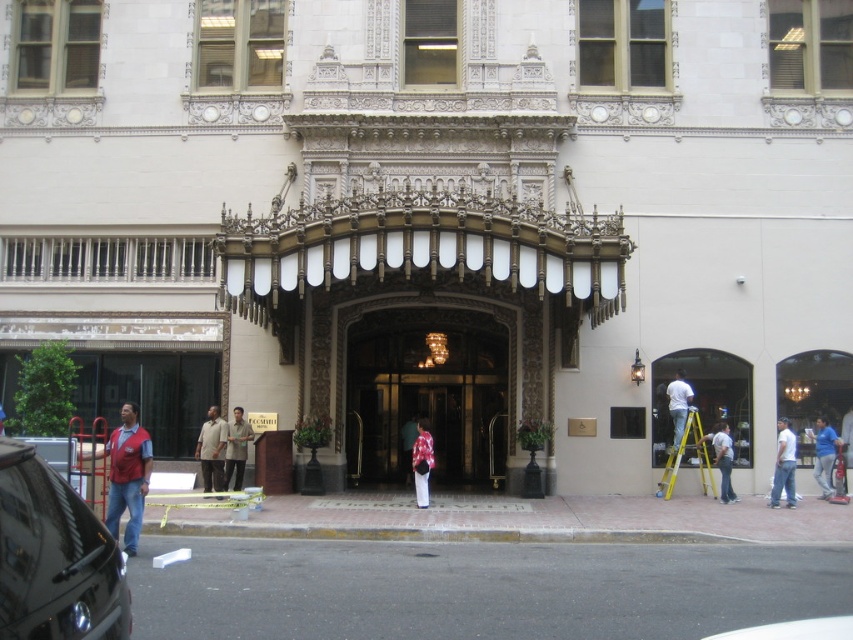
Question: Among these points, which one is farthest from the camera?

Choices:
 (A) (722, 460)
 (B) (465, 360)
 (C) (833, 445)

Answer: (B)

Question: Can you confirm if shiny black car at lower left is bigger than blue cotton shirt at center?

Choices:
 (A) no
 (B) yes

Answer: (B)

Question: Considering the real-world distances, which object is closest to the white fabric shirt at right?

Choices:
 (A) blue cotton shirt at center
 (B) gold polished metal door at center
 (C) denim jeans at right
 (D) yellow/yellowish metallic ladder at right

Answer: (D)

Question: Is clear glass window at center smaller than yellow/yellowish metallic ladder at right?

Choices:
 (A) yes
 (B) no

Answer: (A)

Question: Is blue cotton shirt at center smaller than floral fabric dress at center?

Choices:
 (A) no
 (B) yes

Answer: (A)

Question: Which of the following is the farthest from the observer?

Choices:
 (A) (132, 547)
 (B) (720, 461)
 (C) (705, 422)

Answer: (C)